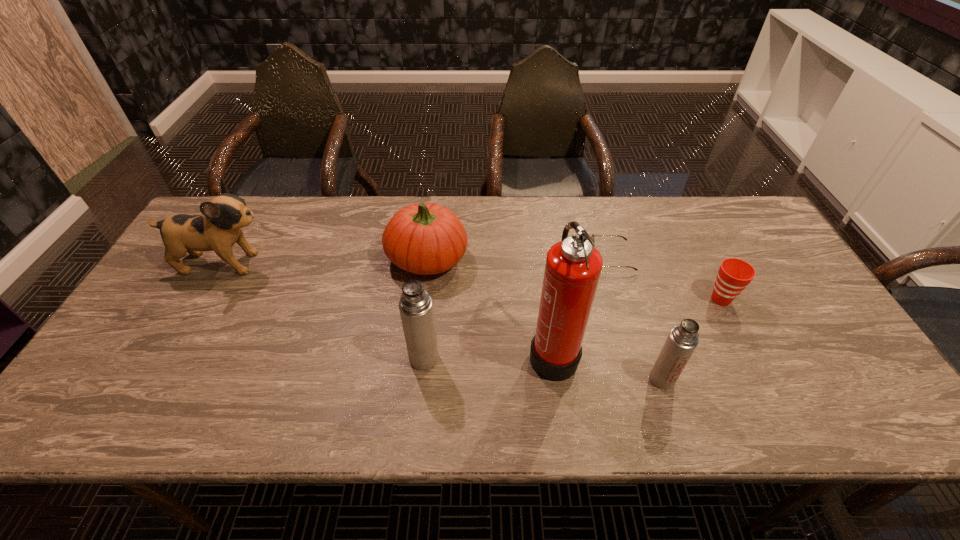
I want to click on free space located 0.380m on the back of the shorter thermos bottle, so click(622, 257).

Locate an element on the screen. free location located at the face of the leftmost object is located at coordinates (391, 263).

I want to click on blank area located 0.130m on the lenses of the shortest object, so click(547, 258).

Where is `free space located 0.170m on the lenses of the shortest object`? free space located 0.170m on the lenses of the shortest object is located at coordinates (534, 258).

The image size is (960, 540). In order to click on free region located 0.150m on the lenses of the shortest object in this screenshot , I will do `click(540, 258)`.

Where is `free space located 0.120m on the back of the cup`? free space located 0.120m on the back of the cup is located at coordinates (700, 258).

Find the location of `free region located 0.180m on the back of the pumpkin`. free region located 0.180m on the back of the pumpkin is located at coordinates (434, 199).

The image size is (960, 540). I want to click on vacant space positioned 0.170m on the front-facing side of the fourth object from left to right, so click(x=458, y=353).

Where is `vacant region located on the front-facing side of the fourth object from left to right`? This screenshot has height=540, width=960. vacant region located on the front-facing side of the fourth object from left to right is located at coordinates (413, 353).

The height and width of the screenshot is (540, 960). What are the coordinates of `vacant area located on the front-facing side of the fourth object from left to right` in the screenshot? It's located at (462, 353).